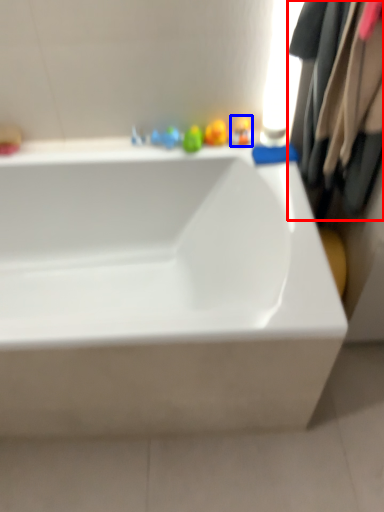
Question: Which object is further to the camera taking this photo, clothing (highlighted by a red box) or toy (highlighted by a blue box)?

Choices:
 (A) clothing
 (B) toy

Answer: (B)